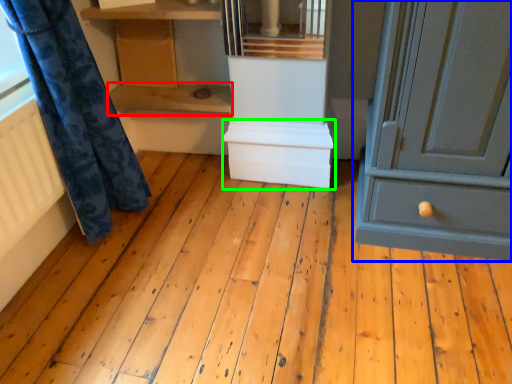
Question: Which object is positioned farthest from shelf (highlighted by a red box)? Select from chest of drawers (highlighted by a blue box) and cabinetry (highlighted by a green box).

Choices:
 (A) chest of drawers
 (B) cabinetry

Answer: (A)